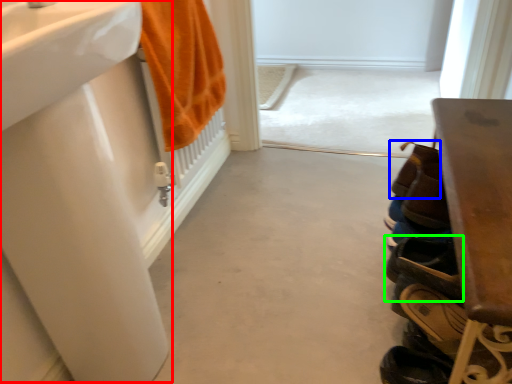
Question: Which object is the closest to the sink (highlighted by a red box)? Choose among these: shoe (highlighted by a blue box) or footwear (highlighted by a green box).

Choices:
 (A) shoe
 (B) footwear

Answer: (B)